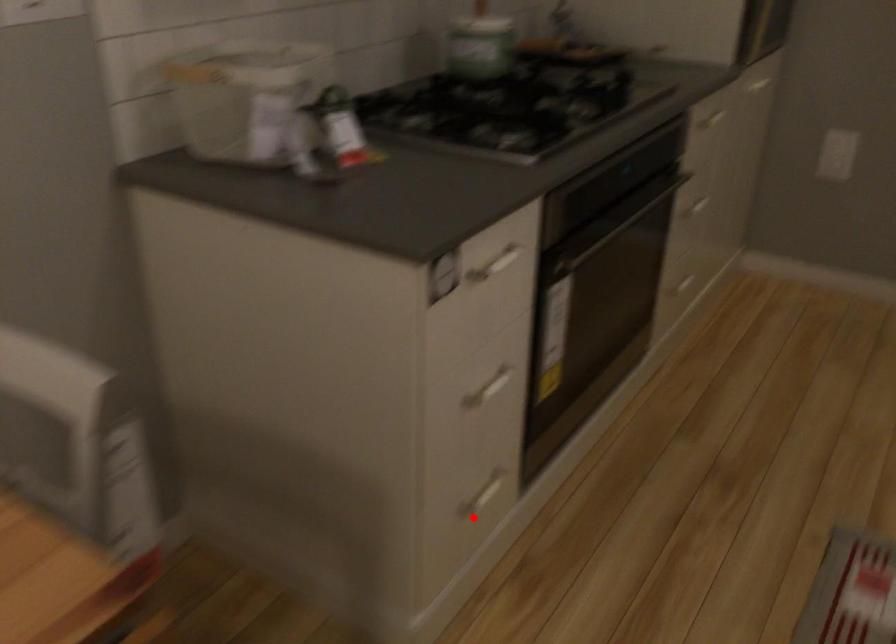
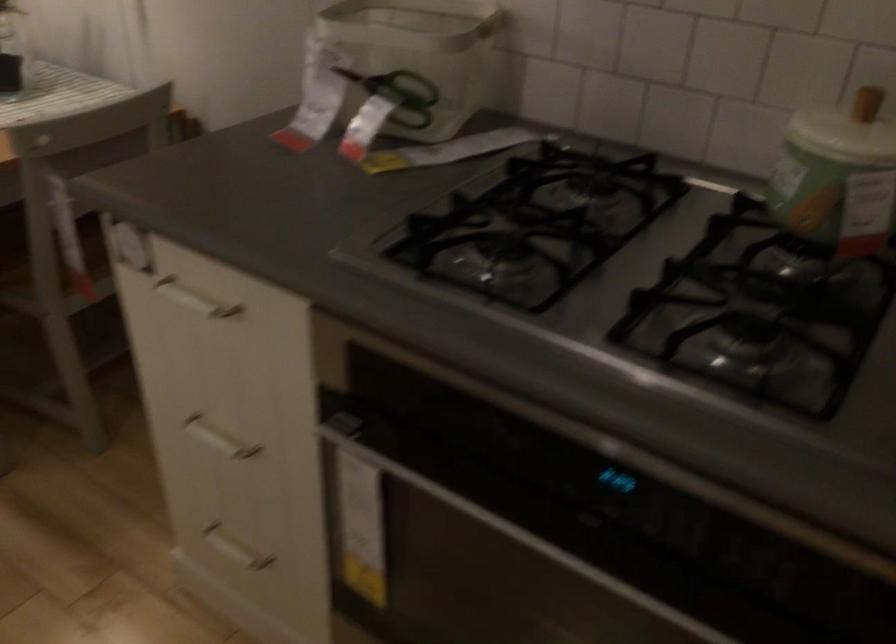
Question: I am providing you with two images of the same scene from different viewpoints. A red point is shown in image1. For the corresponding object point in image2, is it positioned nearer or farther from the camera?

Choices:
 (A) Nearer
 (B) Farther

Answer: (A)